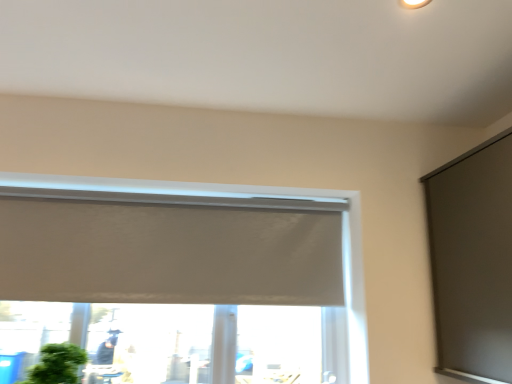
Question: Considering the relative sizes of matte gray screen at right and white matte window at center in the image provided, is matte gray screen at right smaller than white matte window at center?

Choices:
 (A) yes
 (B) no

Answer: (A)

Question: Could you tell me if matte gray screen at right is turned towards white matte window at center?

Choices:
 (A) no
 (B) yes

Answer: (B)

Question: Is matte gray screen at right shorter than white matte window at center?

Choices:
 (A) yes
 (B) no

Answer: (A)

Question: Is matte gray screen at right further to the viewer compared to white matte window at center?

Choices:
 (A) no
 (B) yes

Answer: (A)

Question: Can you confirm if matte gray screen at right is positioned to the left of white matte window at center?

Choices:
 (A) no
 (B) yes

Answer: (A)

Question: Considering the relative positions of green matte houseplant at lower left and white matte window at center in the image provided, is green matte houseplant at lower left to the left or to the right of white matte window at center?

Choices:
 (A) left
 (B) right

Answer: (A)

Question: Does point (55, 375) appear closer or farther from the camera than point (362, 281)?

Choices:
 (A) closer
 (B) farther

Answer: (A)

Question: Based on their sizes in the image, would you say green matte houseplant at lower left is bigger or smaller than white matte window at center?

Choices:
 (A) small
 (B) big

Answer: (A)

Question: From a real-world perspective, is green matte houseplant at lower left positioned above or below white matte window at center?

Choices:
 (A) above
 (B) below

Answer: (B)

Question: Considering the positions of white matte window at center and green matte houseplant at lower left in the image, is white matte window at center bigger or smaller than green matte houseplant at lower left?

Choices:
 (A) small
 (B) big

Answer: (B)

Question: Considering the relative positions of white matte window at center and green matte houseplant at lower left in the image provided, is white matte window at center to the left or to the right of green matte houseplant at lower left?

Choices:
 (A) left
 (B) right

Answer: (B)

Question: From a real-world perspective, relative to green matte houseplant at lower left, is white matte window at center vertically above or below?

Choices:
 (A) below
 (B) above

Answer: (B)

Question: From the image's perspective, is white matte window at center located above or below green matte houseplant at lower left?

Choices:
 (A) above
 (B) below

Answer: (A)

Question: From a real-world perspective, is matte gray screen at right positioned above or below green matte houseplant at lower left?

Choices:
 (A) above
 (B) below

Answer: (A)

Question: In the image, is matte gray screen at right on the left side or the right side of green matte houseplant at lower left?

Choices:
 (A) left
 (B) right

Answer: (B)